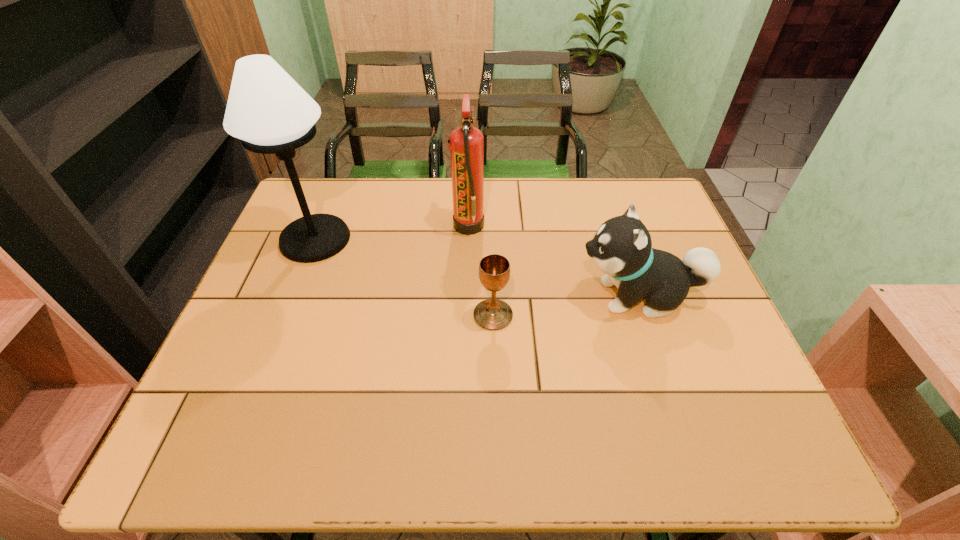
At what (x,y) coordinates should I click in order to perform the action: click on free space located at the face of the rightmost object. Please return your answer as a coordinate pair (x, y). The height and width of the screenshot is (540, 960). Looking at the image, I should click on (446, 296).

This screenshot has width=960, height=540. Identify the location of vacant space located 0.080m on the right of the shortest object. (546, 315).

What are the coordinates of `table lamp at the far edge` in the screenshot? It's located at (269, 112).

This screenshot has width=960, height=540. What are the coordinates of `fire extinguisher that is positioned at the far edge` in the screenshot? It's located at (466, 146).

Where is `object positioned at the left edge`? The height and width of the screenshot is (540, 960). object positioned at the left edge is located at coordinates (269, 112).

Locate an element on the screen. The width and height of the screenshot is (960, 540). object that is positioned at the right edge is located at coordinates (622, 248).

What are the coordinates of `object that is at the far left corner` in the screenshot? It's located at (269, 112).

The image size is (960, 540). In the image, there is a desktop. Identify the location of vacant area at the far edge. (488, 179).

I want to click on vacant space at the near edge of the desktop, so click(334, 431).

In the image, there is a desktop. Where is `vacant space at the left edge`? This screenshot has height=540, width=960. vacant space at the left edge is located at coordinates (231, 340).